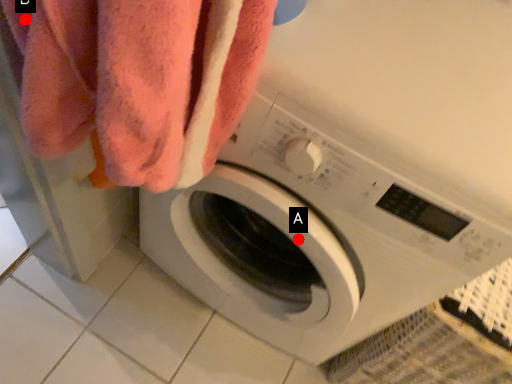
Question: Two points are circled on the image, labeled by A and B beside each circle. Which point is further to the camera?

Choices:
 (A) A is further
 (B) B is further

Answer: (A)